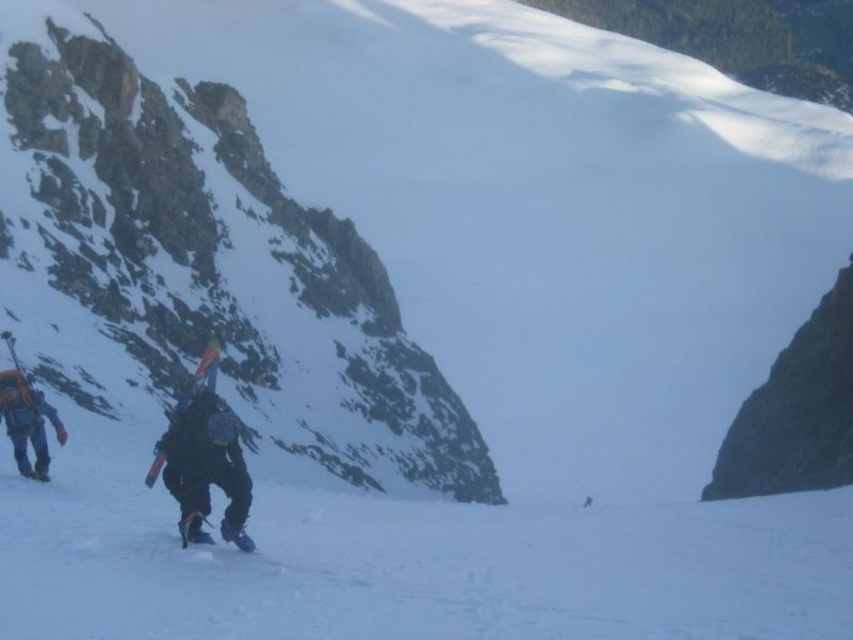
Is orange fabric backpack at left thinner than matte blue ski at center?

Yes.

This screenshot has width=853, height=640. What do you see at coordinates (27, 422) in the screenshot?
I see `orange fabric backpack at left` at bounding box center [27, 422].

Is point (22, 458) positioned behind point (213, 376)?

No, it is in front of (213, 376).

The width and height of the screenshot is (853, 640). In order to click on orange fabric backpack at left in this screenshot , I will do `click(27, 422)`.

This screenshot has height=640, width=853. Find the location of `black fabric backpack at lower left`. black fabric backpack at lower left is located at coordinates (206, 467).

Does black fabric backpack at lower left appear under orange fabric backpack at left?

Yes.

Who is shorter, black fabric backpack at lower left or orange fabric backpack at left?

Standing shorter between the two is black fabric backpack at lower left.

Between point (204, 490) and point (27, 417), which one is positioned behind?

The point (27, 417) is more distant.

Identify the location of black fabric backpack at lower left. (206, 467).